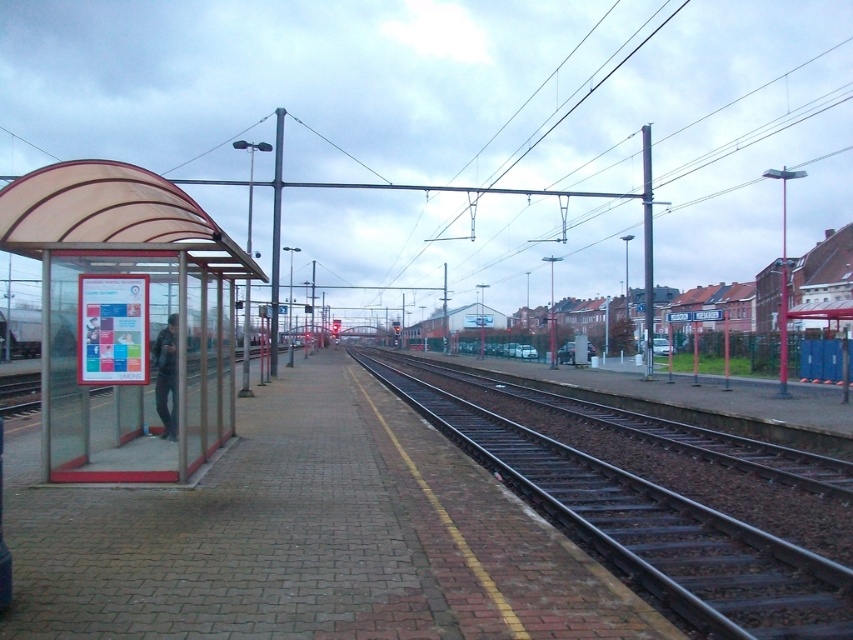
Question: Can you confirm if translucent plastic bus stop at left is bigger than dark gray jacket at left?

Choices:
 (A) no
 (B) yes

Answer: (B)

Question: Which point appears farthest from the camera in this image?

Choices:
 (A) (84, 321)
 (B) (161, 387)
 (C) (718, 529)

Answer: (B)

Question: Does translucent plastic bus stop at left appear over dark gray jacket at left?

Choices:
 (A) no
 (B) yes

Answer: (A)

Question: Does black metal train track at center come behind dark gray jacket at left?

Choices:
 (A) yes
 (B) no

Answer: (B)

Question: Which is farther from the translucent plastic bus stop at left?

Choices:
 (A) black metal train track at center
 (B) dark gray jacket at left

Answer: (A)

Question: Among these points, which one is nearest to the camera?

Choices:
 (A) (757, 627)
 (B) (45, 388)

Answer: (A)